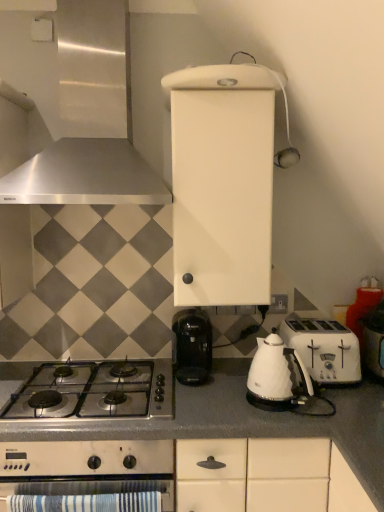
Question: From the image's perspective, is white glossy kettle at lower center located above gray matte countertop at lower center?

Choices:
 (A) no
 (B) yes

Answer: (B)

Question: Is white glossy kettle at lower center positioned with its back to gray matte countertop at lower center?

Choices:
 (A) yes
 (B) no

Answer: (B)

Question: Can you confirm if white glossy kettle at lower center is bigger than gray matte countertop at lower center?

Choices:
 (A) no
 (B) yes

Answer: (A)

Question: Is white glossy kettle at lower center wider than gray matte countertop at lower center?

Choices:
 (A) yes
 (B) no

Answer: (B)

Question: Would you say white glossy kettle at lower center contains gray matte countertop at lower center?

Choices:
 (A) yes
 (B) no

Answer: (B)

Question: Is white glossy kettle at lower center shorter than gray matte countertop at lower center?

Choices:
 (A) yes
 (B) no

Answer: (A)

Question: Is white glossy kettle at lower center behind white plastic toaster at right?

Choices:
 (A) no
 (B) yes

Answer: (A)

Question: Considering the relative positions of white glossy kettle at lower center and white plastic toaster at right in the image provided, is white glossy kettle at lower center to the right of white plastic toaster at right from the viewer's perspective?

Choices:
 (A) no
 (B) yes

Answer: (A)

Question: Is white glossy kettle at lower center far from white plastic toaster at right?

Choices:
 (A) yes
 (B) no

Answer: (B)

Question: Does white glossy kettle at lower center turn towards white plastic toaster at right?

Choices:
 (A) no
 (B) yes

Answer: (A)

Question: Does white glossy kettle at lower center appear on the left side of white plastic toaster at right?

Choices:
 (A) yes
 (B) no

Answer: (A)

Question: Is white glossy kettle at lower center taller than white plastic toaster at right?

Choices:
 (A) yes
 (B) no

Answer: (A)

Question: From a real-world perspective, is white plastic toaster at right positioned under white plastic toaster at right based on gravity?

Choices:
 (A) no
 (B) yes

Answer: (B)